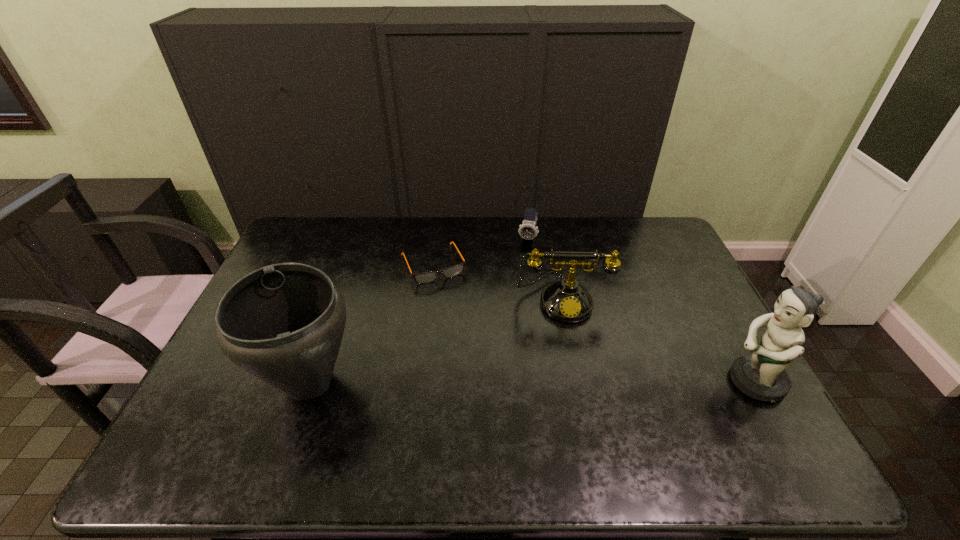
This screenshot has width=960, height=540. Identify the location of watch that is at the far edge. (528, 230).

Where is `urn that is at the near edge`? The image size is (960, 540). urn that is at the near edge is located at coordinates coord(283,323).

You are a GUI agent. You are given a task and a screenshot of the screen. Output one action in this format:
    pyautogui.click(x=<x>, y=<y>)
    Task: Click on the figurine present at the near edge
    This screenshot has height=540, width=960.
    Given the screenshot: What is the action you would take?
    pyautogui.click(x=762, y=376)

Where is `object situated at the left edge`? This screenshot has width=960, height=540. object situated at the left edge is located at coordinates [283, 323].

At what (x,y) coordinates should I click in order to perform the action: click on object present at the right edge. Please return your answer as a coordinate pair (x, y). This screenshot has height=540, width=960. Looking at the image, I should click on (762, 376).

Identify the location of object that is positioned at the near left corner. The height and width of the screenshot is (540, 960). (283, 323).

Locate an element on the screen. The image size is (960, 540). object at the near right corner is located at coordinates (762, 376).

Where is `free space at the far edge`? free space at the far edge is located at coordinates (390, 246).

Image resolution: width=960 pixels, height=540 pixels. In order to click on vacant space at the near edge of the desktop in this screenshot , I will do `click(321, 396)`.

Where is `free region at the left edge of the desktop`? The image size is (960, 540). free region at the left edge of the desktop is located at coordinates (219, 382).